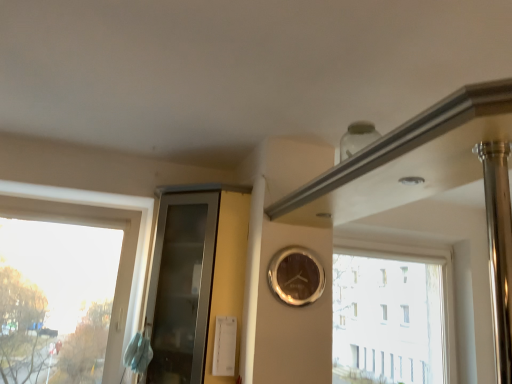
What do you see at coordinates (296, 276) in the screenshot? I see `shiny gold clock at center` at bounding box center [296, 276].

This screenshot has width=512, height=384. I want to click on transparent glass window at upper right, arranged as the 2th window when viewed from the front, so click(394, 311).

Where is `shiny gold clock at center`? The width and height of the screenshot is (512, 384). shiny gold clock at center is located at coordinates (296, 276).

Is transparent glass cabinet at center beside transparent glass window at left, which is the second window from back to front?

No.

Considering the relative sizes of transparent glass cabinet at center and transparent glass window at left, acting as the 1th window starting from the front, in the image provided, is transparent glass cabinet at center shorter than transparent glass window at left, acting as the 1th window starting from the front,?

In fact, transparent glass cabinet at center may be taller than transparent glass window at left, acting as the 1th window starting from the front.

Is transparent glass window at left, which is the second window from back to front, aimed at transparent glass cabinet at center?

No, transparent glass window at left, which is the second window from back to front, does not turn towards transparent glass cabinet at center.

Which object is more forward, transparent glass window at left, which ranks as the second window in right-to-left order, or transparent glass cabinet at center?

transparent glass cabinet at center is in front.

Is transparent glass window at left, which is the second window from back to front, outside of transparent glass cabinet at center?

Yes.

In order to click on glass door on the right of transparent glass window at left, acting as the 1th window starting from the front in this screenshot , I will do `click(181, 287)`.

Is shiny gold clock at center bigger or smaller than transparent glass window at left, which ranks as the second window in right-to-left order?

Clearly, shiny gold clock at center is smaller in size than transparent glass window at left, which ranks as the second window in right-to-left order.

Locate an element on the screen. The width and height of the screenshot is (512, 384). clock above the transparent glass window at left, which ranks as the second window in right-to-left order (from a real-world perspective) is located at coordinates (296, 276).

Is shiny gold clock at center oriented towards transparent glass window at left, which ranks as the second window in right-to-left order?

No, shiny gold clock at center is not turned towards transparent glass window at left, which ranks as the second window in right-to-left order.

From a real-world perspective, which is physically above, shiny gold clock at center or transparent glass window at left, acting as the 1th window starting from the front?

shiny gold clock at center.

Which is more distant, (x=192, y=379) or (x=280, y=297)?

Positioned behind is point (x=192, y=379).

From the image's perspective, who appears lower, transparent glass cabinet at center or shiny gold clock at center?

transparent glass cabinet at center appears lower in the image.

Consider the image. From a real-world perspective, which object rests below the other?

In real-world perspective, transparent glass cabinet at center is lower.

Which of these two, transparent glass cabinet at center or shiny gold clock at center, stands shorter?

Standing shorter between the two is shiny gold clock at center.

Is transparent glass cabinet at center positioned with its back to transparent glass window at upper right, the 1th window in the back-to-front sequence?

Yes, transparent glass window at upper right, the 1th window in the back-to-front sequence, is at the back of transparent glass cabinet at center.

Between transparent glass cabinet at center and transparent glass window at upper right, arranged as the 2th window when viewed from the front, which one has larger size?

Bigger between the two is transparent glass cabinet at center.

Is transparent glass cabinet at center far away from transparent glass window at upper right, the 1th window in the back-to-front sequence?

Yes, transparent glass cabinet at center is far from transparent glass window at upper right, the 1th window in the back-to-front sequence.

Between transparent glass window at left, which is the second window from back to front, and shiny gold clock at center, which one has larger width?

Wider between the two is transparent glass window at left, which is the second window from back to front.

Based on the photo, which is more to the left, transparent glass window at left, acting as the 1th window starting from the front, or shiny gold clock at center?

Positioned to the left is transparent glass window at left, acting as the 1th window starting from the front.

From the picture: Could you tell me if transparent glass window at left, which ranks as the second window in right-to-left order, is turned towards shiny gold clock at center?

No, transparent glass window at left, which ranks as the second window in right-to-left order, does not turn towards shiny gold clock at center.

Between transparent glass window at left, which is the second window from back to front, and shiny gold clock at center, which one has larger size?

Bigger between the two is transparent glass window at left, which is the second window from back to front.

From a real-world perspective, between transparent glass window at upper right, placed as the first window when sorted from right to left, and transparent glass cabinet at center, who is vertically lower?

In real-world perspective, transparent glass window at upper right, placed as the first window when sorted from right to left, is lower.

Does transparent glass window at upper right, placed as the first window when sorted from right to left, have a greater height compared to transparent glass cabinet at center?

In fact, transparent glass window at upper right, placed as the first window when sorted from right to left, may be shorter than transparent glass cabinet at center.

At what (x,y) coordinates should I click in order to perform the action: click on glass door on the right of transparent glass window at left, acting as the 1th window starting from the front. Please return your answer as a coordinate pair (x, y). The image size is (512, 384). Looking at the image, I should click on (181, 287).

You are a GUI agent. You are given a task and a screenshot of the screen. Output one action in this format:
    pyautogui.click(x=<x>, y=<y>)
    Task: Click on the 1st window positioned below the transparent glass cabinet at center (from the image's perspective)
    This screenshot has height=384, width=512.
    Given the screenshot: What is the action you would take?
    (119, 261)

When comparing their distances from transparent glass window at left, which is the second window from back to front, does shiny gold clock at center or transparent glass window at upper right, the 1th window in the back-to-front sequence, seem further?

transparent glass window at upper right, the 1th window in the back-to-front sequence, lies further to transparent glass window at left, which is the second window from back to front, than the other object.

When comparing their distances from transparent glass cabinet at center, does shiny gold clock at center or transparent glass window at left, the 1th window in the left-to-right sequence, seem closer?

transparent glass window at left, the 1th window in the left-to-right sequence.

Based on their spatial positions, is transparent glass window at upper right, arranged as the 2th window when viewed from the front, or transparent glass window at left, which is the second window from back to front, closer to transparent glass cabinet at center?

transparent glass window at left, which is the second window from back to front, is closer to transparent glass cabinet at center.

Which object lies further to the anchor point transparent glass cabinet at center, transparent glass window at left, the 1th window in the left-to-right sequence, or transparent glass window at upper right, the second window when ordered from left to right?

transparent glass window at upper right, the second window when ordered from left to right, is further to transparent glass cabinet at center.

Considering their positions, is transparent glass cabinet at center positioned closer to shiny gold clock at center than transparent glass window at upper right, placed as the first window when sorted from right to left?

transparent glass cabinet at center is closer to shiny gold clock at center.

Which object lies further to the anchor point shiny gold clock at center, transparent glass window at upper right, the 1th window in the back-to-front sequence, or transparent glass window at left, acting as the 1th window starting from the front?

Among the two, transparent glass window at upper right, the 1th window in the back-to-front sequence, is located further to shiny gold clock at center.

From the image, which object appears to be farther from transparent glass window at left, which is the second window from back to front, transparent glass window at upper right, placed as the first window when sorted from right to left, or shiny gold clock at center?

transparent glass window at upper right, placed as the first window when sorted from right to left, is further to transparent glass window at left, which is the second window from back to front.

From the image, which object appears to be farther from shiny gold clock at center, transparent glass cabinet at center or transparent glass window at left, the 1th window in the left-to-right sequence?

transparent glass window at left, the 1th window in the left-to-right sequence.

You are a GUI agent. You are given a task and a screenshot of the screen. Output one action in this format:
    pyautogui.click(x=<x>, y=<y>)
    Task: Click on the clock between transparent glass window at left, acting as the 1th window starting from the front, and transparent glass window at upper right, the second window when ordered from left to right
    The height and width of the screenshot is (384, 512).
    Given the screenshot: What is the action you would take?
    pyautogui.click(x=296, y=276)

At what (x,y) coordinates should I click in order to perform the action: click on clock located between transparent glass cabinet at center and transparent glass window at upper right, the 1th window in the back-to-front sequence, in the left-right direction. Please return your answer as a coordinate pair (x, y). This screenshot has width=512, height=384. Looking at the image, I should click on (296, 276).

Identify the location of glass door between transparent glass window at left, which ranks as the second window in right-to-left order, and transparent glass window at upper right, placed as the first window when sorted from right to left. This screenshot has width=512, height=384. (181, 287).

Locate an element on the screen. The height and width of the screenshot is (384, 512). glass door between transparent glass window at left, which is the second window from back to front, and shiny gold clock at center, in the horizontal direction is located at coordinates (181, 287).